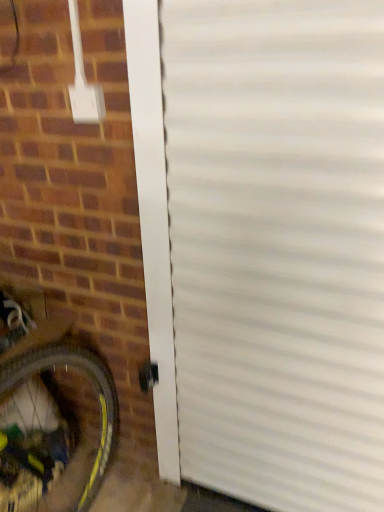
Question: From a real-world perspective, is white corrugated door at center physically located above or below brown brick at lower left?

Choices:
 (A) above
 (B) below

Answer: (A)

Question: Relative to brown brick at lower left, is white corrugated door at center in front or behind?

Choices:
 (A) behind
 (B) front

Answer: (A)

Question: Which is farther from the brown brick at lower left?

Choices:
 (A) white corrugated door at center
 (B) yellow rubber bicycle wheel at lower left

Answer: (A)

Question: Which object is the farthest from the yellow rubber bicycle wheel at lower left?

Choices:
 (A) brown brick at lower left
 (B) white corrugated door at center

Answer: (B)